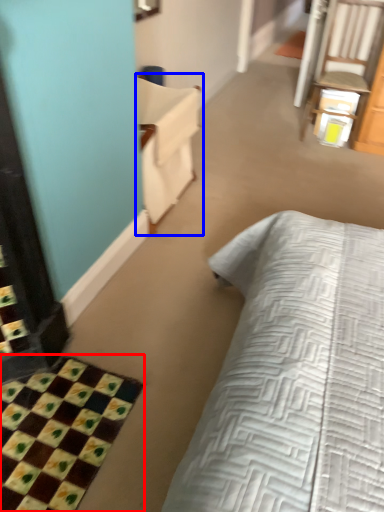
Question: Which of the following is the closest to the observer, bath mat (highlighted by a red box) or armchair (highlighted by a blue box)?

Choices:
 (A) bath mat
 (B) armchair

Answer: (A)